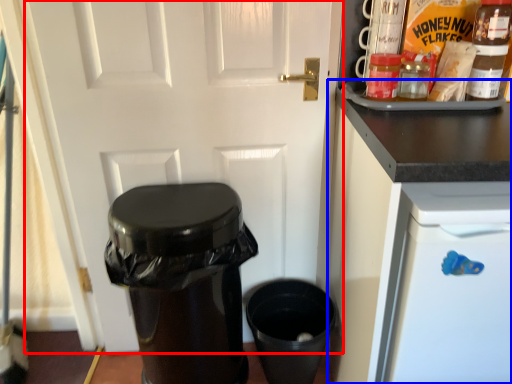
Question: Which point is further to the camera, door (highlighted by a red box) or cabinetry (highlighted by a blue box)?

Choices:
 (A) door
 (B) cabinetry

Answer: (A)